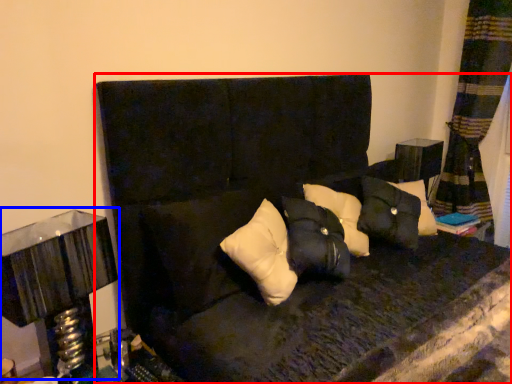
Question: Which of the following is the farthest to the observer, furniture (highlighted by a red box) or table lamp (highlighted by a blue box)?

Choices:
 (A) furniture
 (B) table lamp

Answer: (B)